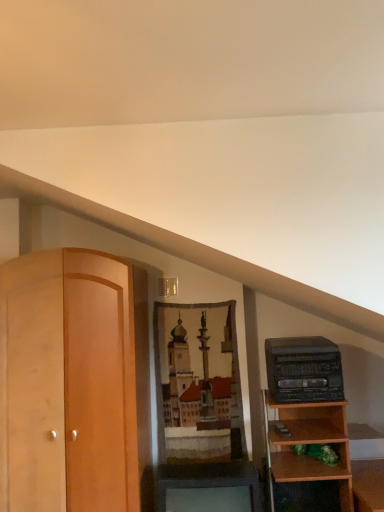
Question: Can you confirm if black plastic stereo at right is bigger than matte black cabinet at lower center?

Choices:
 (A) no
 (B) yes

Answer: (A)

Question: Does black plastic stereo at right have a lesser width compared to matte black cabinet at lower center?

Choices:
 (A) no
 (B) yes

Answer: (B)

Question: Is black plastic stereo at right turned away from matte black cabinet at lower center?

Choices:
 (A) yes
 (B) no

Answer: (B)

Question: From the image's perspective, is black plastic stereo at right below matte black cabinet at lower center?

Choices:
 (A) no
 (B) yes

Answer: (A)

Question: From a real-world perspective, does black plastic stereo at right stand above matte black cabinet at lower center?

Choices:
 (A) yes
 (B) no

Answer: (A)

Question: From the image's perspective, is black plastic stereo at right on top of matte black cabinet at lower center?

Choices:
 (A) yes
 (B) no

Answer: (A)

Question: Is matte black cabinet at lower center in front of black plastic stereo at right?

Choices:
 (A) no
 (B) yes

Answer: (B)

Question: Are matte black cabinet at lower center and black plastic stereo at right beside each other?

Choices:
 (A) no
 (B) yes

Answer: (A)

Question: From a real-world perspective, is matte black cabinet at lower center over black plastic stereo at right?

Choices:
 (A) no
 (B) yes

Answer: (A)

Question: From the image's perspective, is matte black cabinet at lower center above black plastic stereo at right?

Choices:
 (A) no
 (B) yes

Answer: (A)

Question: Does matte black cabinet at lower center appear on the right side of black plastic stereo at right?

Choices:
 (A) yes
 (B) no

Answer: (B)

Question: Is matte black cabinet at lower center located outside black plastic stereo at right?

Choices:
 (A) no
 (B) yes

Answer: (B)

Question: From a real-world perspective, is matte black cabinet at lower center positioned above or below black plastic stereo at right?

Choices:
 (A) below
 (B) above

Answer: (A)